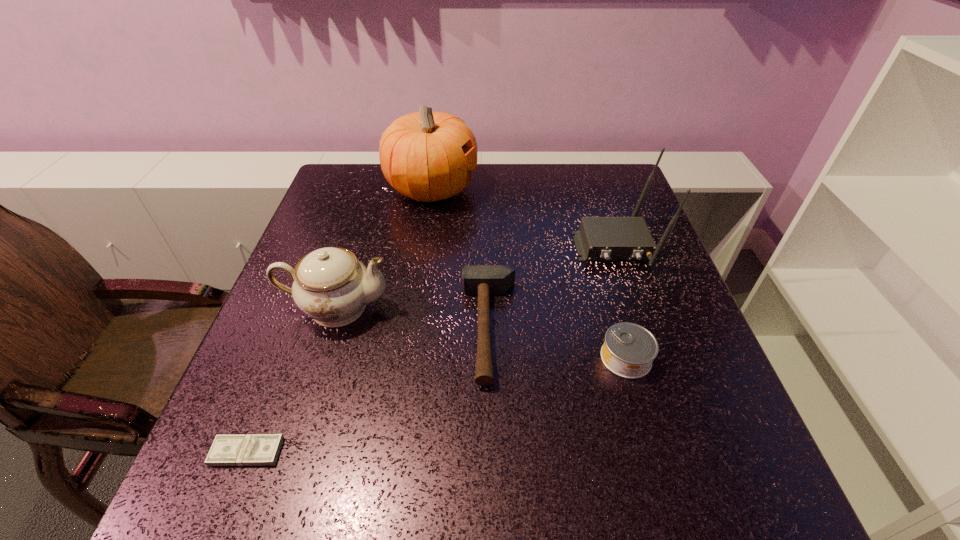
At what (x,y) coordinates should I click in order to perform the action: click on vacant space situated 0.230m on the front of the can. Please return your answer as a coordinate pair (x, y). The width and height of the screenshot is (960, 540). Looking at the image, I should click on (670, 511).

You are a GUI agent. You are given a task and a screenshot of the screen. Output one action in this format:
    pyautogui.click(x=<x>, y=<y>)
    Task: Click on the vacant space situated 0.130m on the striking surface of the hammer
    This screenshot has height=540, width=960.
    Given the screenshot: What is the action you would take?
    pyautogui.click(x=398, y=328)

This screenshot has width=960, height=540. Find the location of `vacant region located on the striking surface of the hammer`. vacant region located on the striking surface of the hammer is located at coordinates (346, 328).

Where is `free region located 0.130m on the striking surface of the hammer`? Image resolution: width=960 pixels, height=540 pixels. free region located 0.130m on the striking surface of the hammer is located at coordinates (398, 328).

I want to click on free space located 0.350m on the right of the shortest object, so click(492, 452).

Where is `object located at the far edge`? object located at the far edge is located at coordinates 427,156.

Locate an element on the screen. object situated at the near edge is located at coordinates (250, 449).

Where is `chinaware present at the left edge`? Image resolution: width=960 pixels, height=540 pixels. chinaware present at the left edge is located at coordinates click(x=330, y=285).

You are a GUI agent. You are given a task and a screenshot of the screen. Output one action in this format:
    pyautogui.click(x=<x>, y=<y>)
    Task: Click on the money situated at the left edge
    The image size is (960, 540).
    Given the screenshot: What is the action you would take?
    pyautogui.click(x=250, y=449)

You are a GUI agent. You are given a task and a screenshot of the screen. Output one action in this format:
    pyautogui.click(x=<x>, y=<y>)
    Task: Click on the router that is at the right edge
    
    Given the screenshot: What is the action you would take?
    pyautogui.click(x=599, y=238)